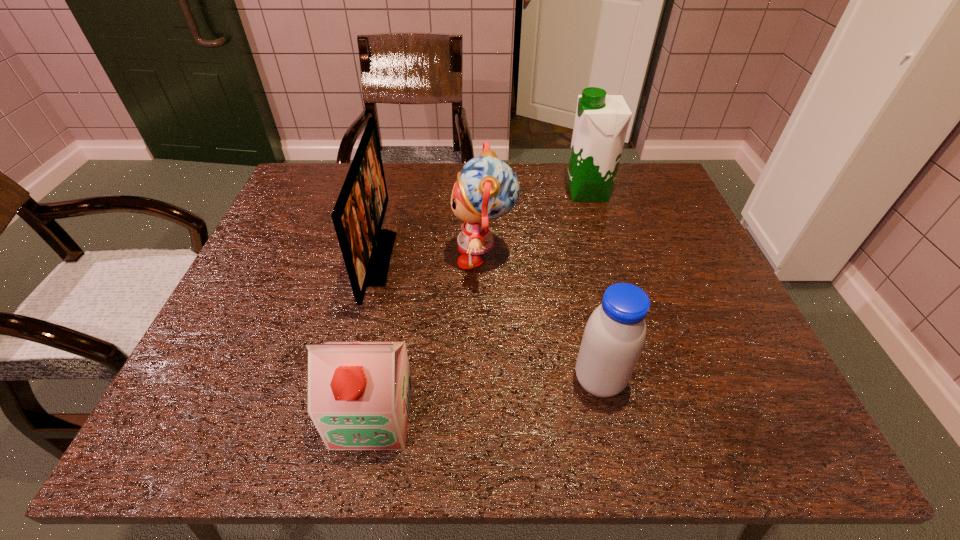
Find the location of a particular element. This screenshot has height=540, width=960. free space located on the face of the third object from right to left is located at coordinates (329, 256).

Identify the location of free space located on the face of the third object from right to left. The image size is (960, 540). (381, 256).

The width and height of the screenshot is (960, 540). In order to click on object positioned at the far edge in this screenshot , I will do `click(601, 122)`.

The width and height of the screenshot is (960, 540). I want to click on vacant area at the far edge, so click(414, 194).

Identify the location of free spot at the near edge of the desktop. Image resolution: width=960 pixels, height=540 pixels. (577, 446).

The image size is (960, 540). I want to click on vacant space at the left edge of the desktop, so click(222, 374).

Image resolution: width=960 pixels, height=540 pixels. I want to click on vacant space at the far left corner of the desktop, so click(x=307, y=183).

In the image, there is a desktop. At what (x,y) coordinates should I click in order to perform the action: click on free region at the far right corner. Please return your answer as a coordinate pair (x, y). This screenshot has width=960, height=540. Looking at the image, I should click on (641, 179).

Identify the location of vacant area between the doll and the leftmost soya milk. (428, 335).

The height and width of the screenshot is (540, 960). Identify the location of vacant space in between the third object from left to right and the farthest object. (536, 224).